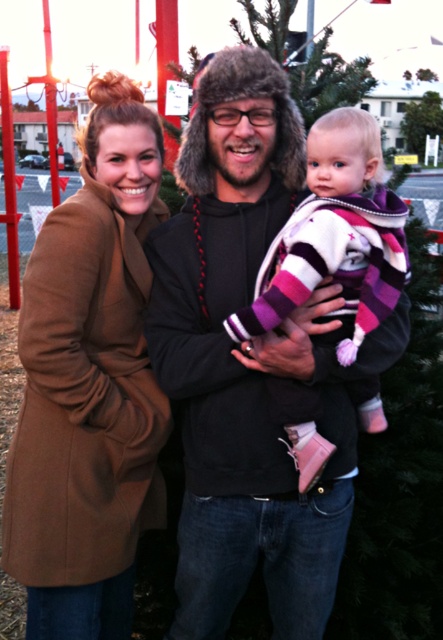
You are a photographer standing 5 feet away from the camera. You want to take a picture of the brown wool coat at center. Can you reach the coat without moving the camera?

The brown wool coat at center and camera are 6.09 feet apart from each other. Since you are 5 feet away from the camera, you are only 1.09 feet away from the coat, so you can reach it without moving the camera.